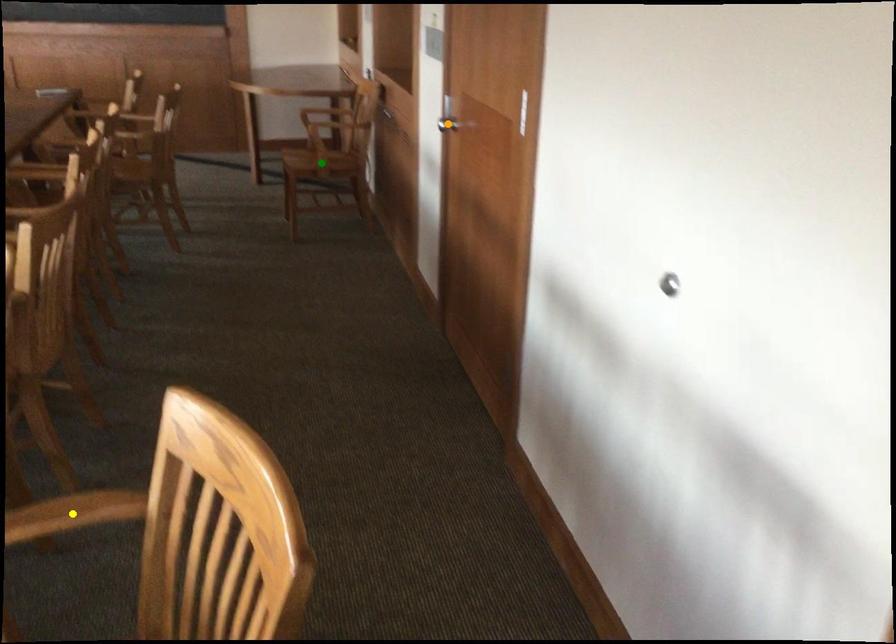
Order these from farthest to nearest:
orange point | green point | yellow point

green point, orange point, yellow point